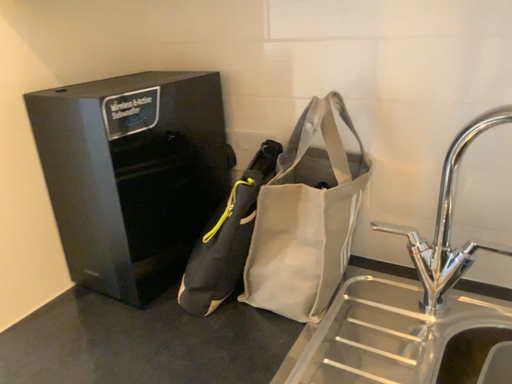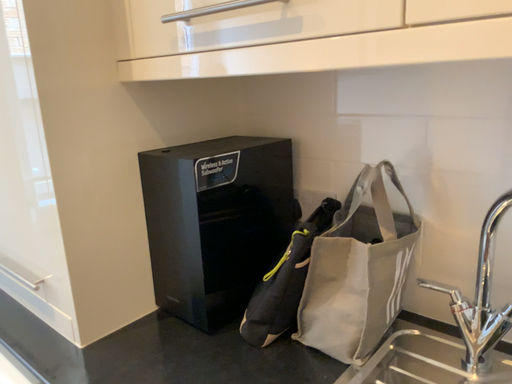
Question: Which way did the camera rotate in the video?

Choices:
 (A) rotated upward
 (B) rotated downward

Answer: (A)